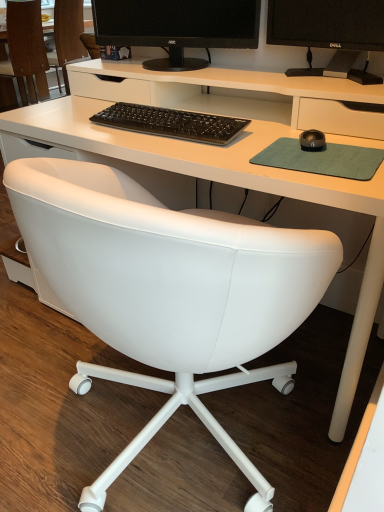
Question: From the image's perspective, is green felt mousepad at right located above or below white leather chair at center, placed as the 1th chair when sorted from right to left?

Choices:
 (A) above
 (B) below

Answer: (B)

Question: Looking at the image, does green felt mousepad at right seem bigger or smaller compared to white leather chair at center, which is the second chair from left to right?

Choices:
 (A) small
 (B) big

Answer: (A)

Question: Estimate the real-world distances between objects in this image. Which object is closer to the black matte keyboard at center?

Choices:
 (A) green felt mousepad at right
 (B) black rubberized mouse at center-right
 (C) black matte monitor at upper center
 (D) white leather chair at lower left, the 2th chair positioned from the right
 (E) black glossy monitor at upper right

Answer: (A)

Question: Which object is positioned farthest from the white leather chair at center, which is the second chair from left to right?

Choices:
 (A) black glossy monitor at upper right
 (B) white leather chair at lower left, positioned as the 1th chair in left-to-right order
 (C) black matte keyboard at center
 (D) black rubberized mouse at center-right
 (E) green felt mousepad at right

Answer: (B)